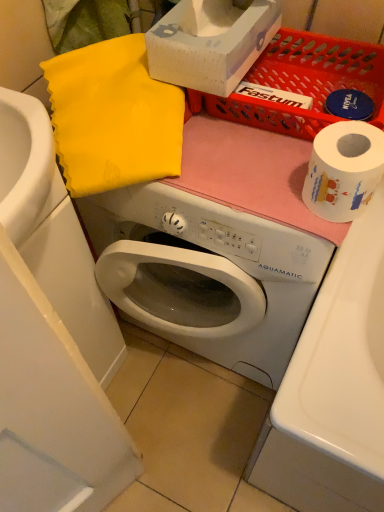
I want to click on free point behind white paper at right, so click(x=272, y=140).